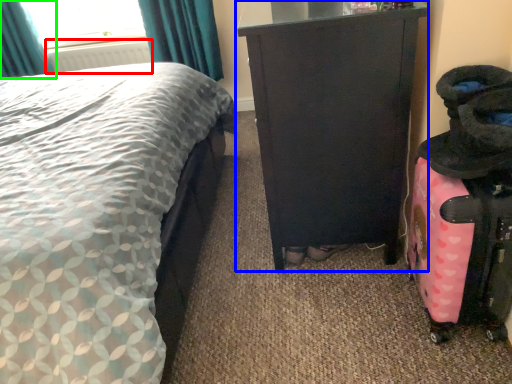
Question: Based on their relative distances, which object is nearer to radiator (highlighted by a red box)? Choose from furniture (highlighted by a blue box) and curtain (highlighted by a green box).

Choices:
 (A) furniture
 (B) curtain

Answer: (B)